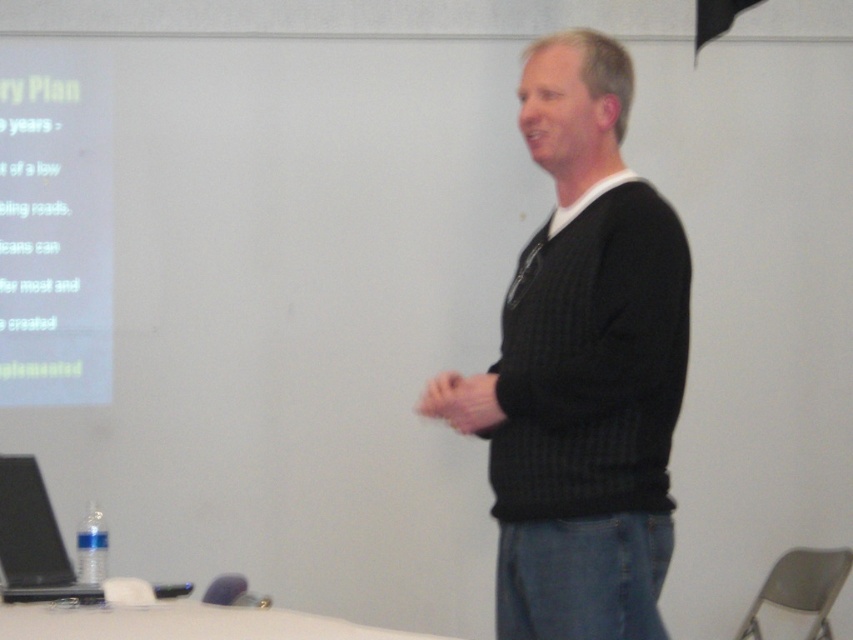
Does black knitted sweater at center have a lesser width compared to black matte laptop at lower left?

No.

Is point (515, 308) closer to viewer compared to point (28, 538)?

Yes, it is in front of point (28, 538).

Is point (656, 204) more distant than point (51, 531)?

That is False.

The image size is (853, 640). Find the location of `black knitted sweater at center`. black knitted sweater at center is located at coordinates (582, 368).

Does black knitted sweater at center appear over white paper at upper left?

No, black knitted sweater at center is not above white paper at upper left.

Does black knitted sweater at center have a greater height compared to white paper at upper left?

Indeed, black knitted sweater at center has a greater height compared to white paper at upper left.

Which is behind, point (608, 195) or point (74, 68)?

Positioned behind is point (74, 68).

I want to click on black knitted sweater at center, so click(582, 368).

Who is lower down, white paper at upper left or black matte laptop at lower left?

Positioned lower is black matte laptop at lower left.

How much distance is there between white paper at upper left and black matte laptop at lower left?

A distance of 4.87 feet exists between white paper at upper left and black matte laptop at lower left.

Between point (53, 52) and point (64, 556), which one is positioned behind?

The point (53, 52) is behind.

In order to click on white paper at upper left in this screenshot , I will do `click(54, 227)`.